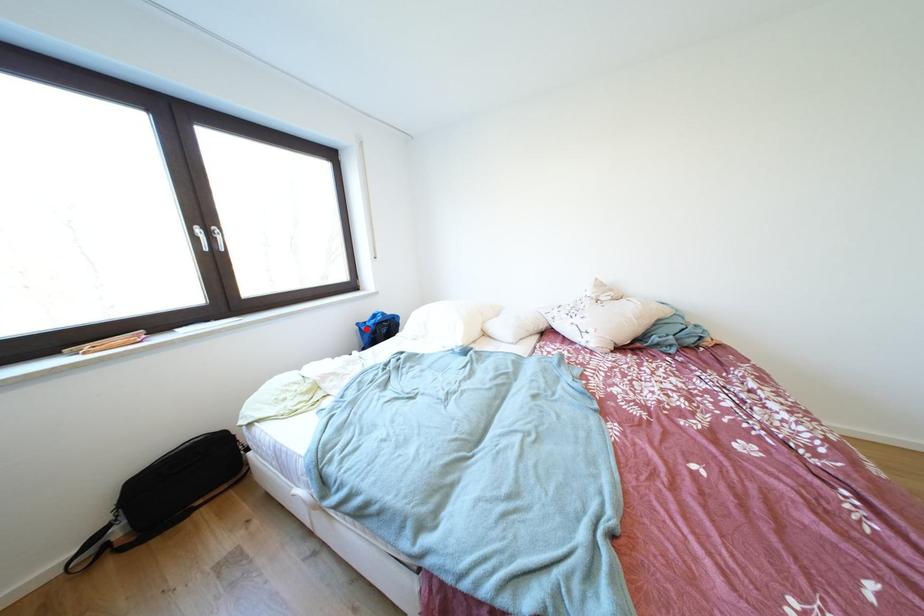
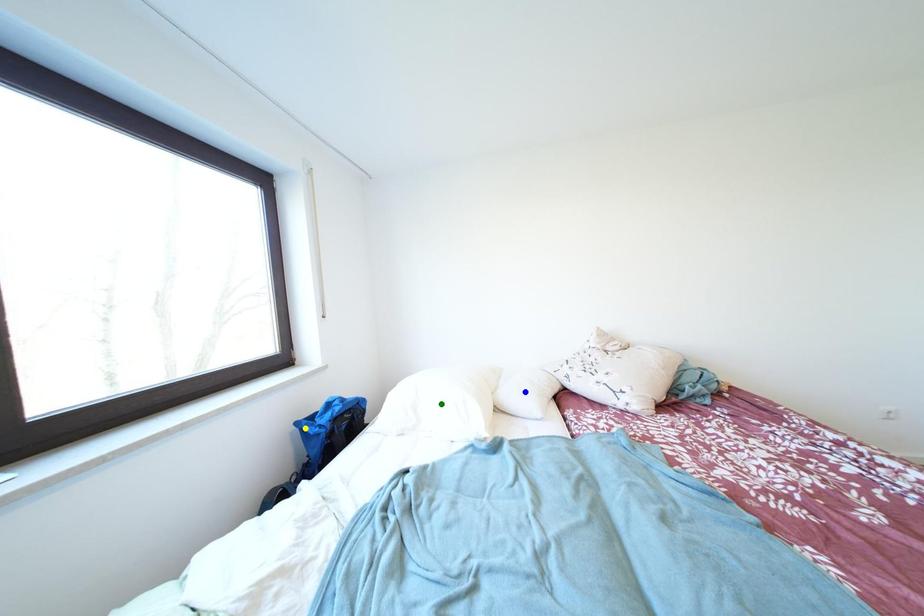
Question: I am providing you with two images of the same scene from different viewpoints. A red point is marked on the first image. You are given multiple points on the second image. Which point in image 2 is actually the same real-world point as the red point in image 1?

Choices:
 (A) blue point
 (B) green point
 (C) yellow point

Answer: (C)